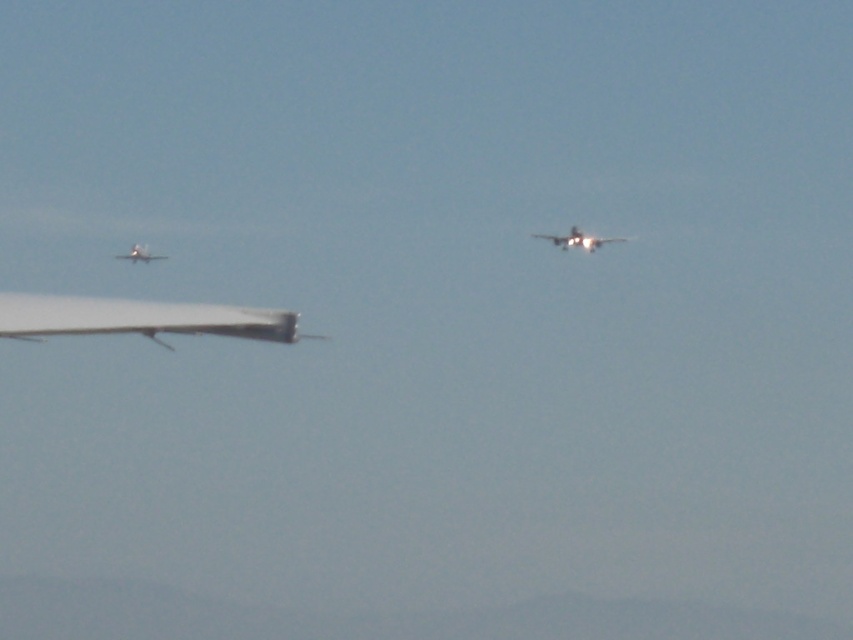
From the picture: Can you confirm if white matte airplane at left is wider than metallic silver airplane at left?

Incorrect, white matte airplane at left's width does not surpass metallic silver airplane at left's.

At what (x,y) coordinates should I click in order to perform the action: click on white matte airplane at left. Please return your answer as a coordinate pair (x, y). The width and height of the screenshot is (853, 640). Looking at the image, I should click on pyautogui.click(x=138, y=317).

Describe the element at coordinates (138, 317) in the screenshot. I see `white matte airplane at left` at that location.

Where is `white matte airplane at left`? This screenshot has width=853, height=640. white matte airplane at left is located at coordinates (138, 317).

Describe the element at coordinates (577, 240) in the screenshot. I see `shiny silver airplane at center` at that location.

Is point (564, 241) positioned behind point (144, 259)?

That is False.

Is point (555, 243) positioned before point (149, 259)?

Yes, it is.

Locate an element on the screen. This screenshot has height=640, width=853. shiny silver airplane at center is located at coordinates (577, 240).

Which is above, white matte airplane at left or shiny silver airplane at center?

Positioned higher is shiny silver airplane at center.

Can you confirm if white matte airplane at left is thinner than shiny silver airplane at center?

Yes, white matte airplane at left is thinner than shiny silver airplane at center.

Is point (242, 333) less distant than point (590, 246)?

Yes, point (242, 333) is in front of point (590, 246).

The image size is (853, 640). I want to click on white matte airplane at left, so click(138, 317).